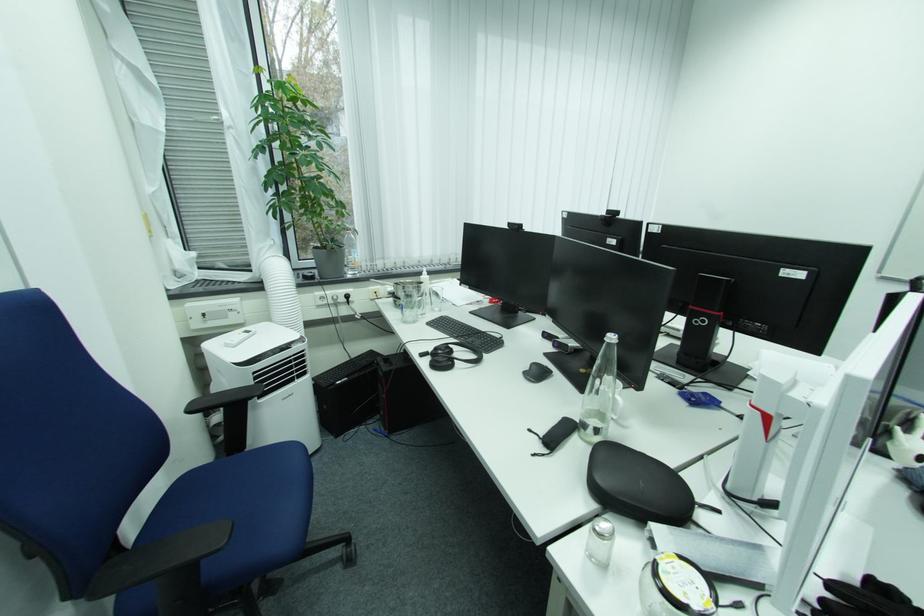
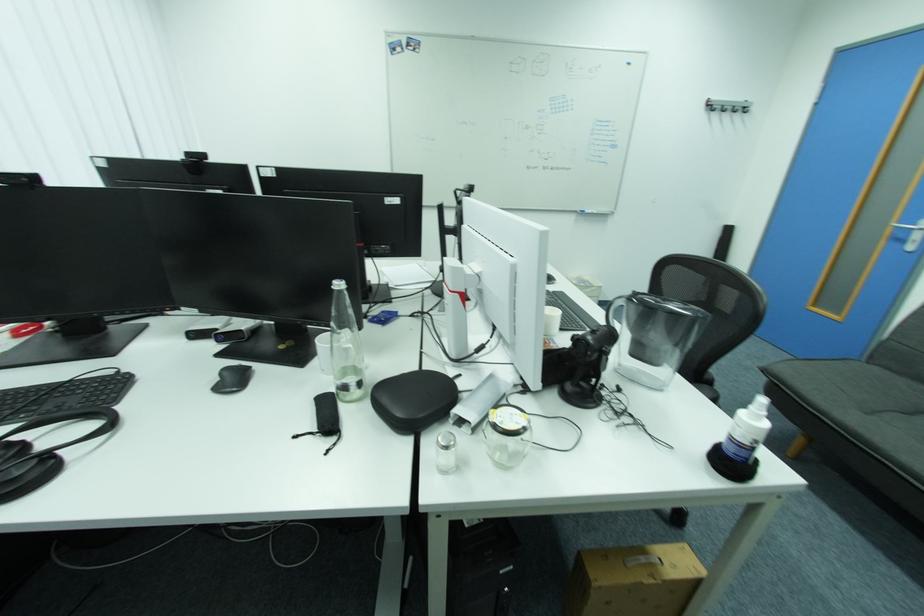
Locate, in the second image, the point that corresponds to (606,536) in the first image.

(453, 448)